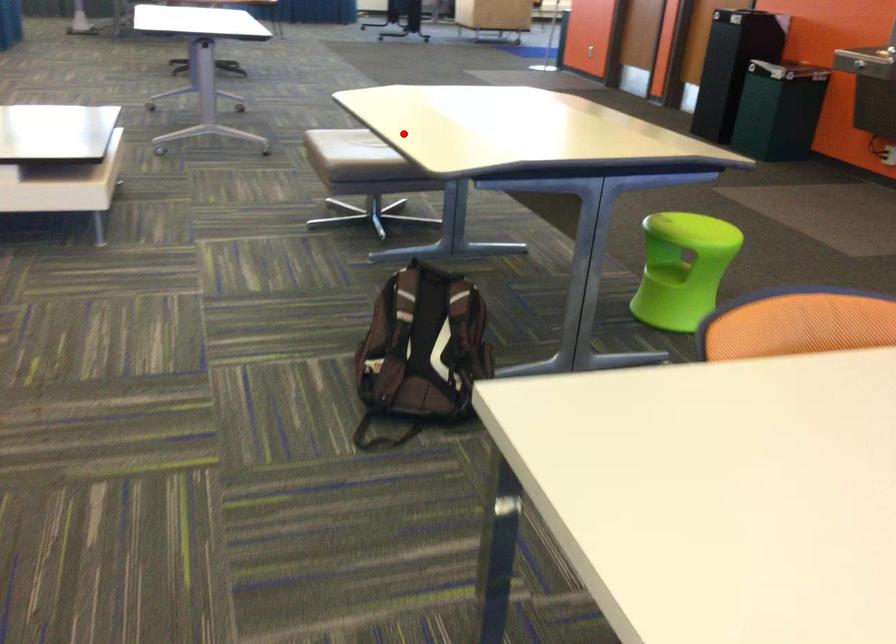
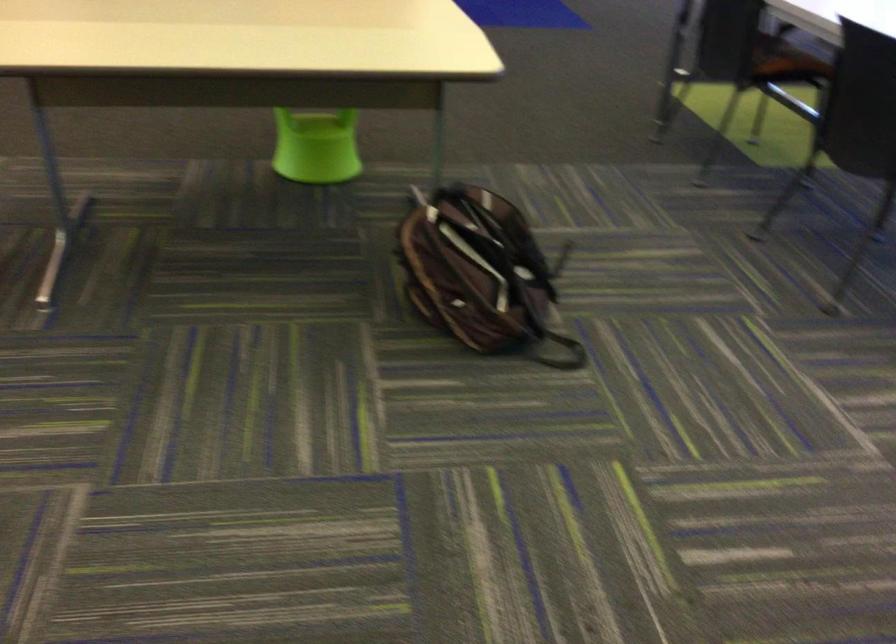
Find the pixel in the second image that matches the highlighted location in the first image.

(322, 67)